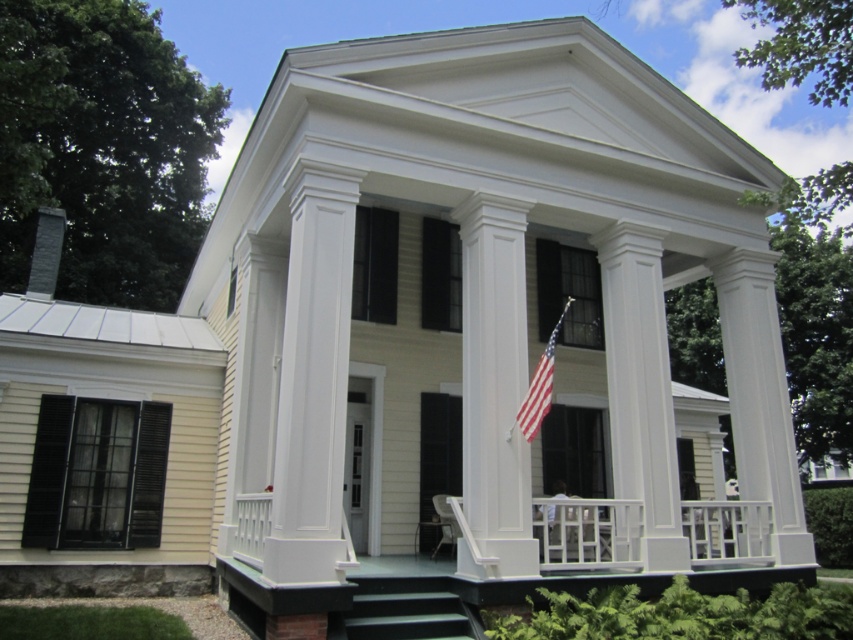
How distant is dark green concrete stairs at lower center from american flag at center?

dark green concrete stairs at lower center is 2.20 meters from american flag at center.

Can you confirm if dark green concrete stairs at lower center is positioned below american flag at center?

Yes.

Who is more forward, (422, 621) or (524, 428)?

Point (422, 621)

This screenshot has height=640, width=853. In order to click on dark green concrete stairs at lower center in this screenshot , I will do `click(402, 611)`.

Does point (480, 508) come in front of point (424, 628)?

That is False.

Between white glossy column at center and dark green concrete stairs at lower center, which one has less height?

dark green concrete stairs at lower center

Find the location of `white glossy column at center`. white glossy column at center is located at coordinates (494, 392).

Find the location of a particular element. The width and height of the screenshot is (853, 640). white glossy column at center is located at coordinates (494, 392).

Which is more to the left, white glossy column at center or american flag at center?

Positioned to the left is white glossy column at center.

The height and width of the screenshot is (640, 853). In order to click on white glossy column at center in this screenshot , I will do `click(494, 392)`.